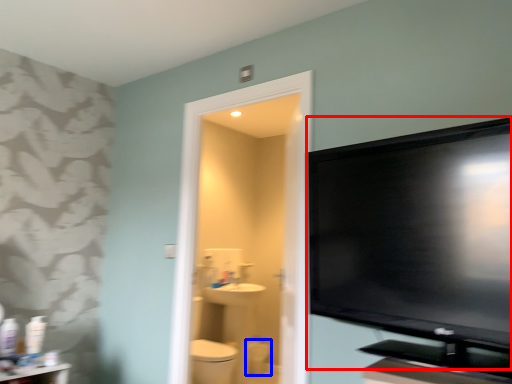
Question: Among these objects, which one is farthest to the camera, television (highlighted by a red box) or toilet bowl (highlighted by a blue box)?

Choices:
 (A) television
 (B) toilet bowl

Answer: (B)